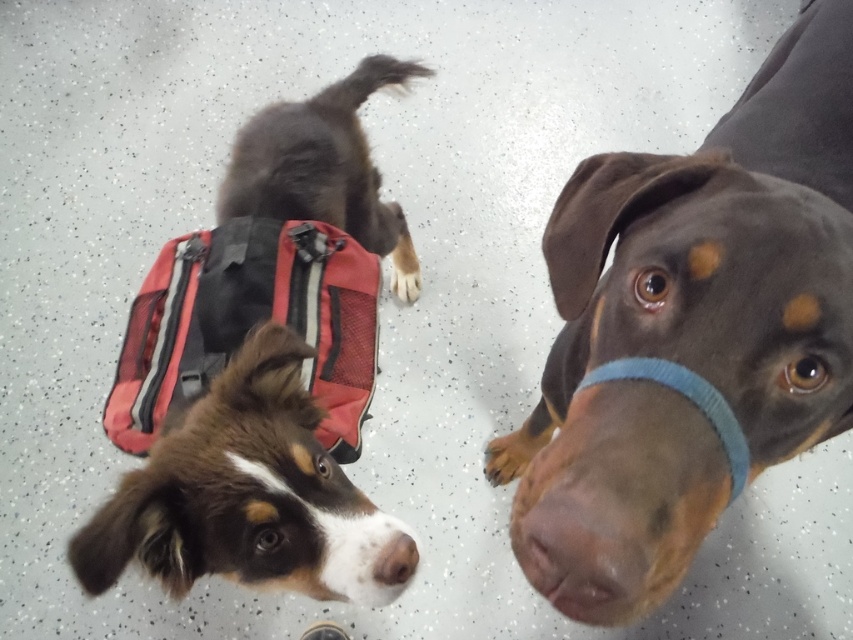
Question: Based on their relative distances, which object is farther from the brown smooth coat at center?

Choices:
 (A) brown furry dog at lower left
 (B) dark brown fur at upper center

Answer: (B)

Question: Can you confirm if brown furry dog at lower left is bigger than red mesh bag at upper left?

Choices:
 (A) no
 (B) yes

Answer: (A)

Question: Does brown smooth coat at center have a lesser width compared to brown furry dog at lower left?

Choices:
 (A) yes
 (B) no

Answer: (B)

Question: Which object appears farthest from the camera in this image?

Choices:
 (A) brown matte nose at lower center
 (B) red mesh bag at upper left

Answer: (B)

Question: Is brown smooth coat at center positioned at the back of dark brown fur at upper center?

Choices:
 (A) yes
 (B) no

Answer: (B)

Question: Which of the following is the closest to the observer?

Choices:
 (A) pos(395,573)
 (B) pos(633,256)

Answer: (B)